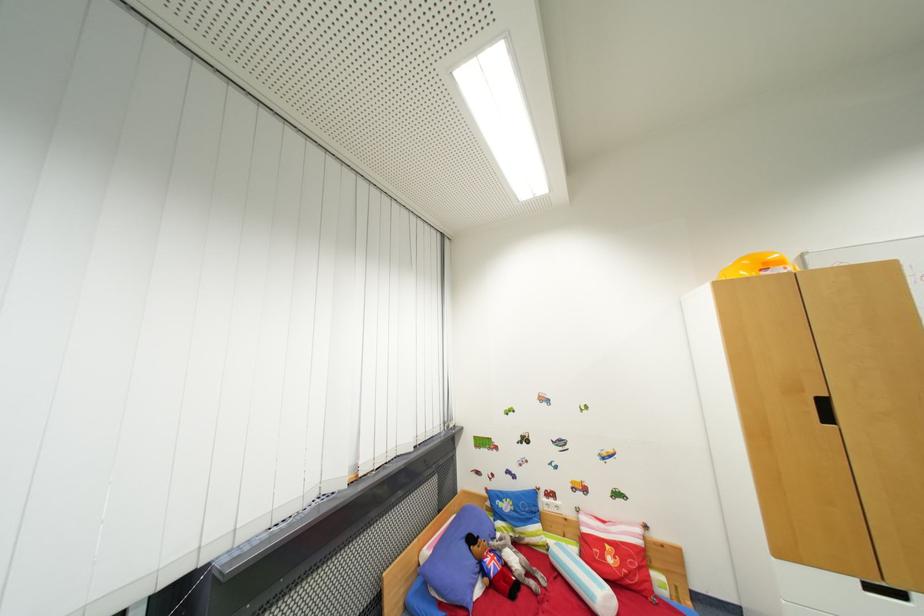
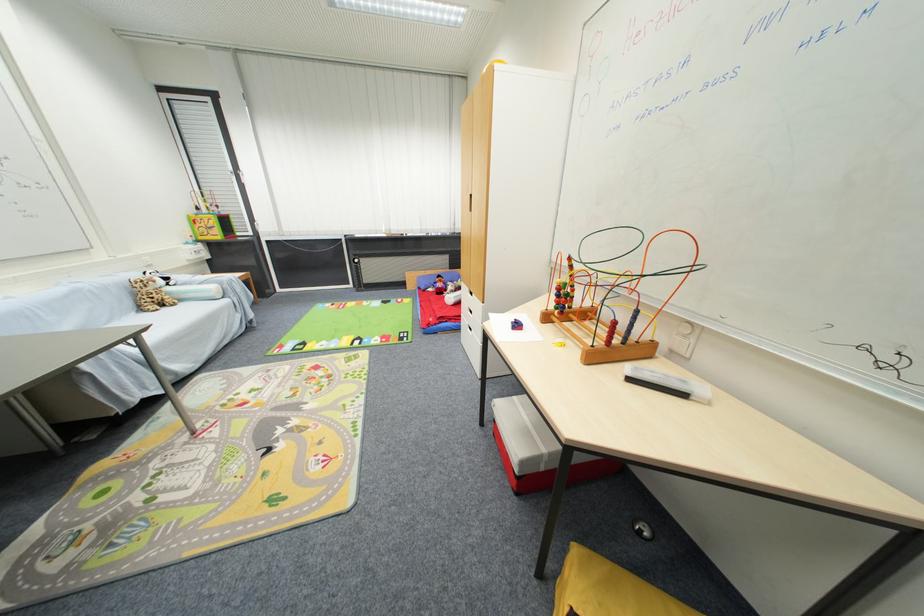
Question: I am providing you with two images of the same scene from different viewpoints. Please identify which objects are invisible in image2.

Choices:
 (A) green product bottle
 (B) sofa sitting surface
 (C) black cabinet handle
 (D) white drawer handle

Answer: (C)